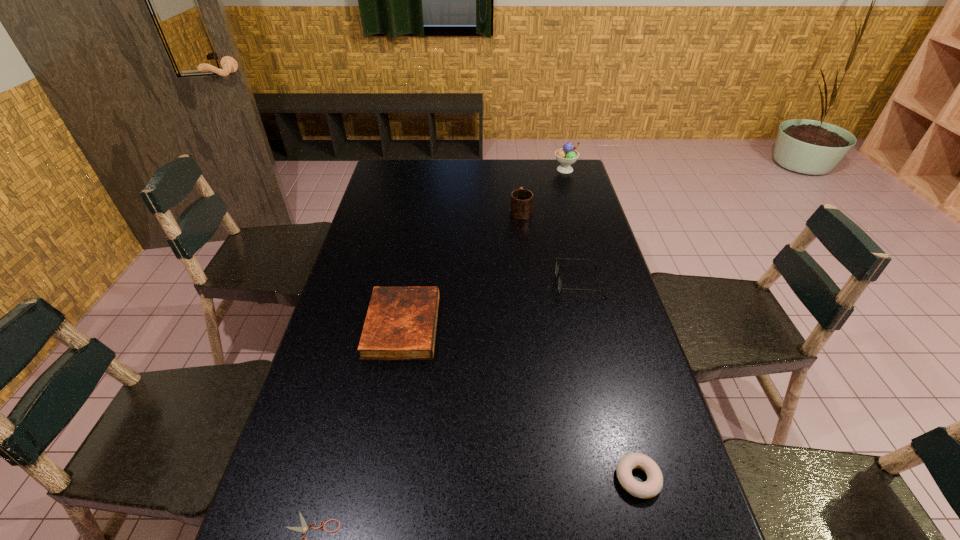
I want to click on the third closest object to the second shortest object, so click(304, 528).

Identify the location of object that stands as the second closest to the mug. The width and height of the screenshot is (960, 540). (560, 289).

I want to click on vacant space that satisfies the following two spatial constraints: 1. on the front-facing side of the fourth shortest object; 2. on the back side of the second nearest object, so click(x=628, y=478).

Locate an element on the screen. vacant space that satisfies the following two spatial constraints: 1. on the front side of the icecream; 2. on the front-facing side of the third tallest object is located at coordinates (598, 283).

You are a GUI agent. You are given a task and a screenshot of the screen. Output one action in this format:
    pyautogui.click(x=<x>, y=<y>)
    Task: Click on the vacant space that satisfies the following two spatial constraints: 1. on the front-facing side of the doughnut; 2. on the right side of the spectacles
    
    Given the screenshot: What is the action you would take?
    pyautogui.click(x=628, y=478)